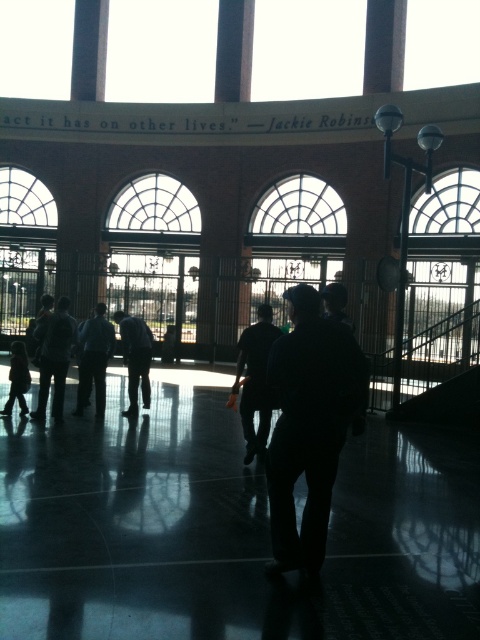
Question: Which point is farther from the camera taking this photo?

Choices:
 (A) (12, 205)
 (B) (316, 202)
 (C) (12, 205)
 (D) (132, 416)

Answer: (C)

Question: Is clear glass window at left to the right of clear glass window at upper right from the viewer's perspective?

Choices:
 (A) no
 (B) yes

Answer: (A)

Question: Which is nearer to the dark gray jacket at center?

Choices:
 (A) dark gray suit at center
 (B) dark blue shirt at center
 (C) clear glass window at upper left
 (D) clear glass dome at center

Answer: (A)

Question: Can you confirm if clear glass dome at center is positioned above dark gray jacket at center?

Choices:
 (A) yes
 (B) no

Answer: (A)

Question: Which object appears closest to the camera in this image?

Choices:
 (A) clear glass window at left
 (B) light pink fabric at lower left
 (C) dark blue jeans at center

Answer: (C)

Question: Does dark fabric jacket at center have a larger size compared to dark blue shirt at center?

Choices:
 (A) no
 (B) yes

Answer: (A)